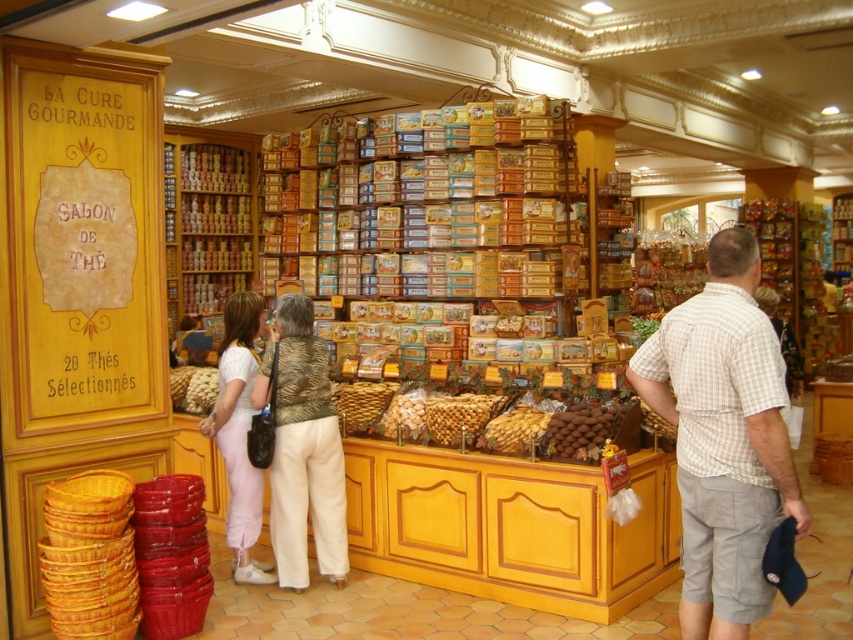
You are a customer in the shop and want to buy the plaid cotton shirt at center and the matte white pants at center. The store has a policy that items placed to the right of each other get a 10 discount. Can you get the discount?

The plaid cotton shirt at center is to the right of the matte white pants at center, so they qualify for the 10 discount.

You are a customer in the shop and want to grab both the plaid cotton shirt at center and the brown chocolate at center. Which item is taller?

The plaid cotton shirt at center is taller than the brown chocolate at center.

You are a customer in the shop and want to place a matte white pants at center on top of brown chocolate at center. Can you do that? Please explain why or why not based on their positions.

The matte white pants at center is 5.01 feet away from brown chocolate at center. Since they are not positioned directly on top of each other, you cannot place the matte white pants at center on top of the brown chocolate at center.